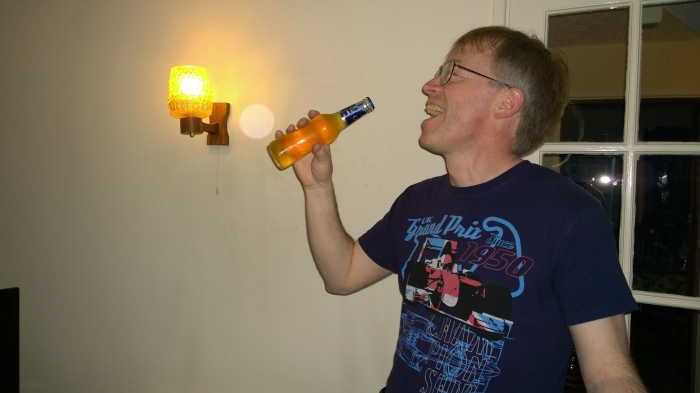
Where is `wall`? Image resolution: width=700 pixels, height=393 pixels. wall is located at coordinates (106, 165).